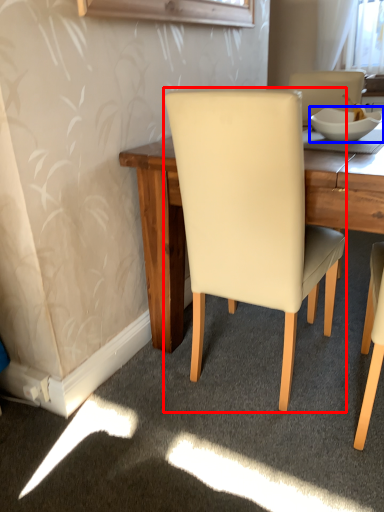
Question: Which point is closer to the camera, chair (highlighted by a red box) or bowl (highlighted by a blue box)?

Choices:
 (A) chair
 (B) bowl

Answer: (A)